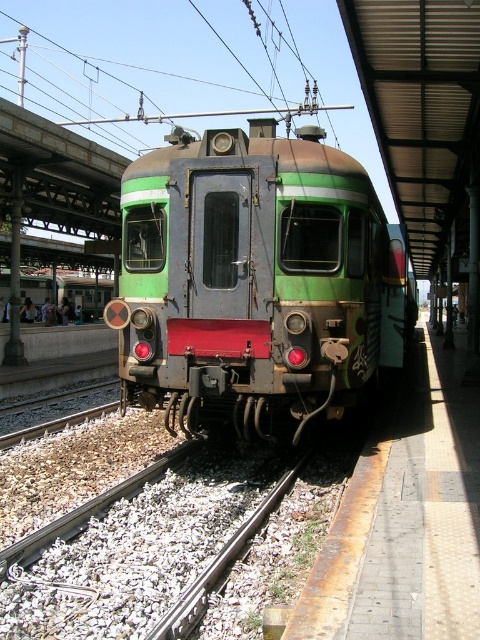
Question: Is rusty metal train at center bigger than gray gravel track at lower left?

Choices:
 (A) yes
 (B) no

Answer: (A)

Question: Which point is farther from the camera taking this photo?

Choices:
 (A) [60, 602]
 (B) [355, 186]

Answer: (B)

Question: In this image, where is rusty metal train at center located relative to gray gravel track at lower left?

Choices:
 (A) left
 (B) right

Answer: (B)

Question: Which of the following is the closest to the observer?

Choices:
 (A) (x=109, y=550)
 (B) (x=340, y=244)

Answer: (A)

Question: Does rusty metal train at center appear on the left side of gray gravel track at lower left?

Choices:
 (A) yes
 (B) no

Answer: (B)